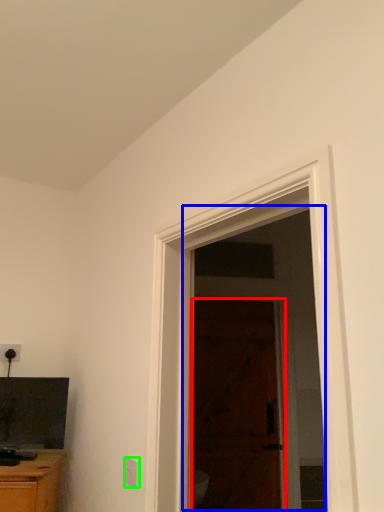
Question: Which object is the closest to the door (highlighted by a red box)? Choose among these: screen door (highlighted by a blue box) or electric outlet (highlighted by a green box).

Choices:
 (A) screen door
 (B) electric outlet

Answer: (A)